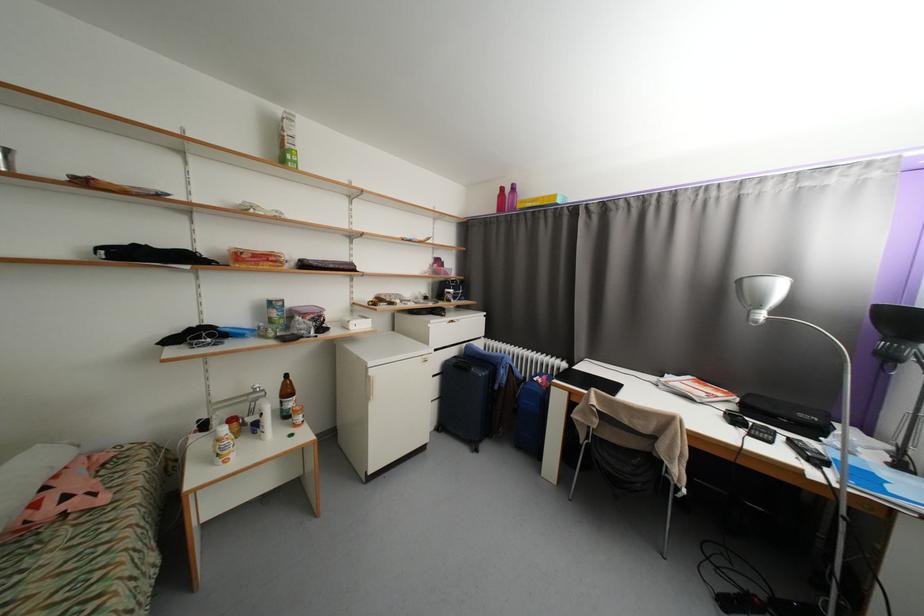
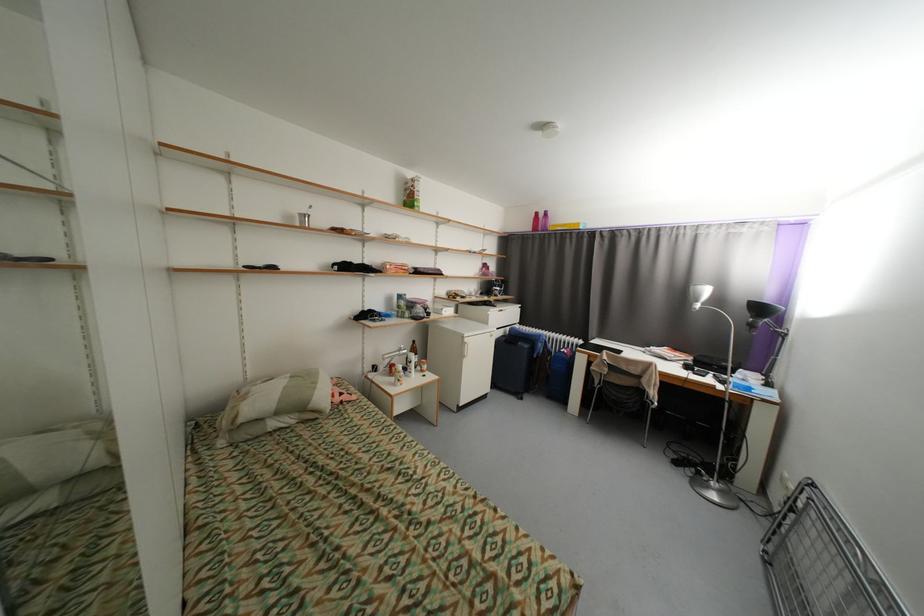
Where in the second image is the point corresponding to point (508, 190) from the first image?

(542, 215)